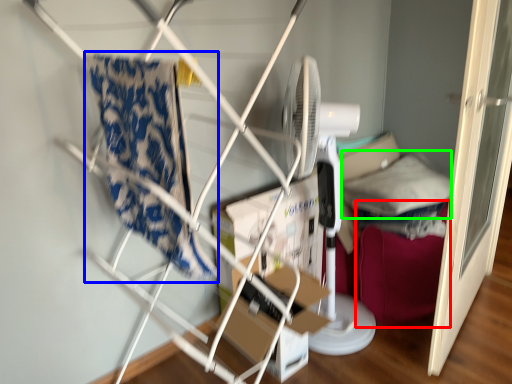
Question: Which is nearer to the bean bag chair (highlighted by a red box)? beach towel (highlighted by a blue box) or pillow (highlighted by a green box).

Choices:
 (A) beach towel
 (B) pillow

Answer: (B)